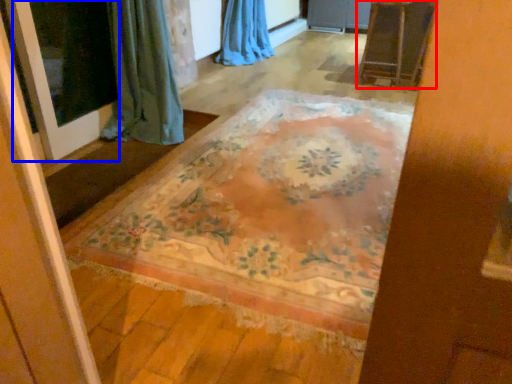
Question: Among these objects, which one is nearest to the camera, furniture (highlighted by a red box) or screen door (highlighted by a blue box)?

Choices:
 (A) furniture
 (B) screen door

Answer: (B)